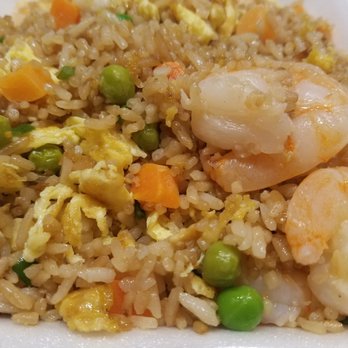
Where is `plate`? plate is located at coordinates (164, 340).